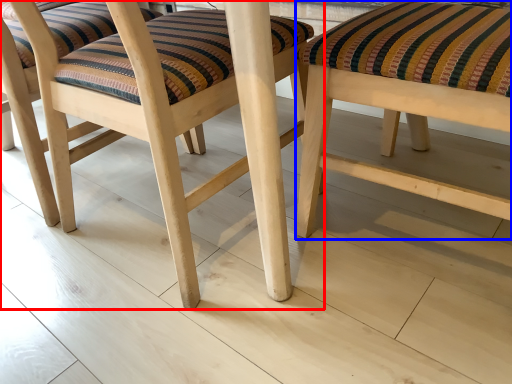
Question: Which point is closer to the camera, stool (highlighted by a red box) or stool (highlighted by a blue box)?

Choices:
 (A) stool
 (B) stool

Answer: (B)